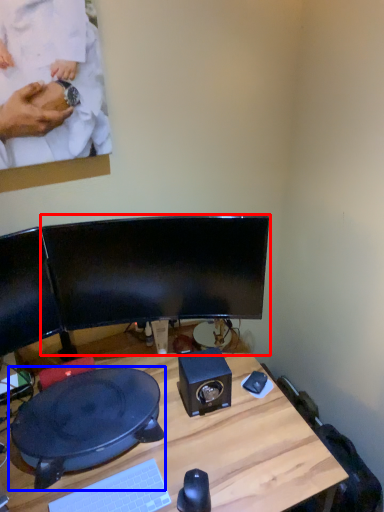
Question: Among these objects, which one is farthest to the camera, computer monitor (highlighted by a red box) or sit (highlighted by a blue box)?

Choices:
 (A) computer monitor
 (B) sit

Answer: (A)